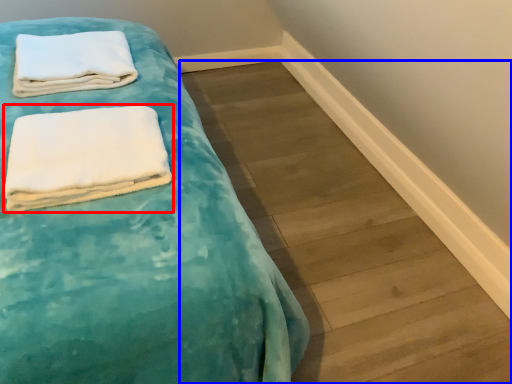
Question: Among these objects, which one is nearest to the camera, towel (highlighted by a red box) or plank (highlighted by a blue box)?

Choices:
 (A) towel
 (B) plank

Answer: (A)